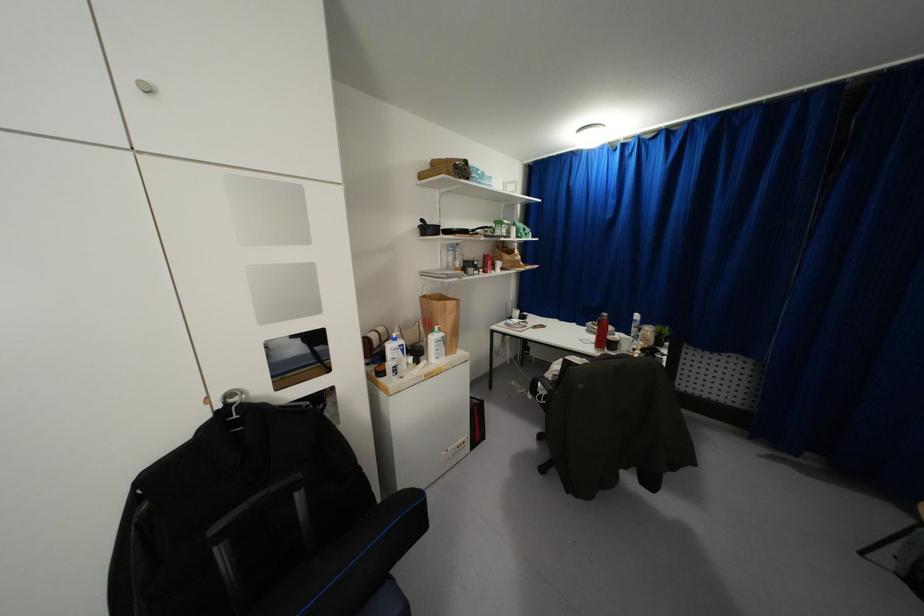
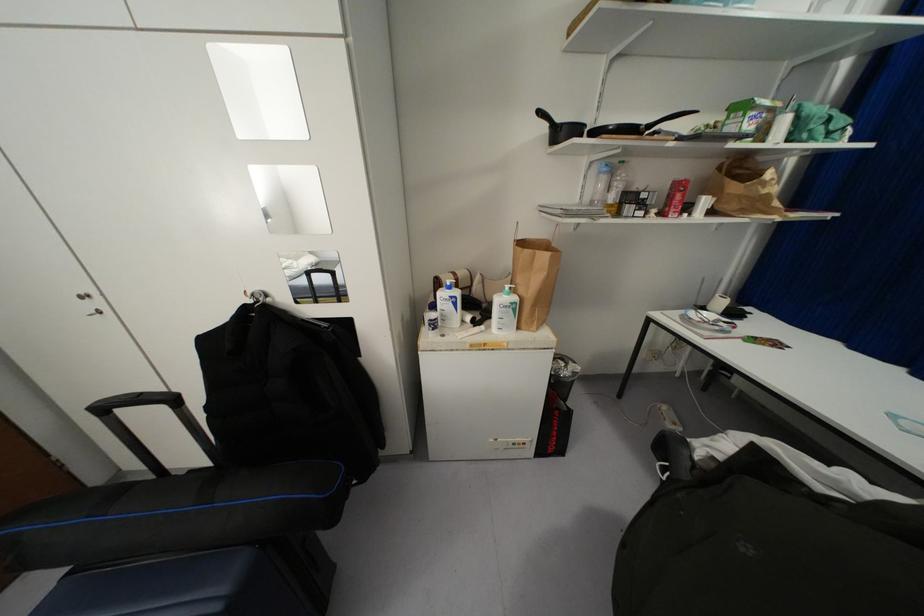
From the picture: Based on the continuous images, in which direction is the camera rotating?

The rotation direction of the camera is left-down.